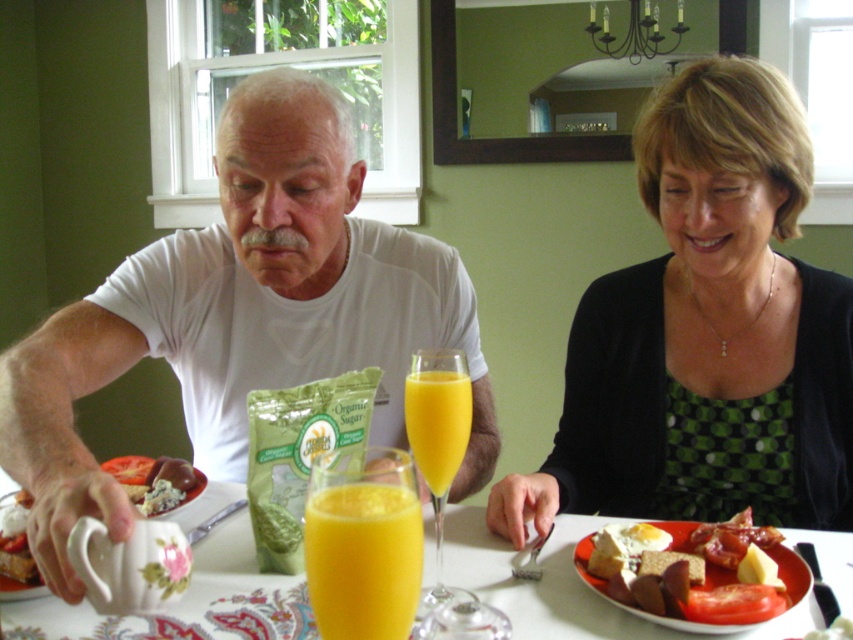
Find the location of `white matte t-shirt at center`. white matte t-shirt at center is located at coordinates (242, 316).

Identify the location of white matte t-shirt at center. Image resolution: width=853 pixels, height=640 pixels. (242, 316).

Where is `white matte t-shirt at center`? white matte t-shirt at center is located at coordinates (242, 316).

Does golden yellow liquid at center lie behind blue cheese crumbles at center?

No, golden yellow liquid at center is in front of blue cheese crumbles at center.

Is golden yellow liquid at center bigger than blue cheese crumbles at center?

Actually, golden yellow liquid at center might be smaller than blue cheese crumbles at center.

Which is in front, point (416, 445) or point (103, 465)?

Point (416, 445)

This screenshot has height=640, width=853. Identify the location of golden yellow liquid at center. (438, 420).

Is soft-boiled egg at center positioned in front of matte white creamer at lower left?

Yes, it is.

At what (x,y) coordinates should I click in order to perform the action: click on soft-boiled egg at center. Please return your answer as a coordinate pair (x, y). The width and height of the screenshot is (853, 640). Looking at the image, I should click on (636, 609).